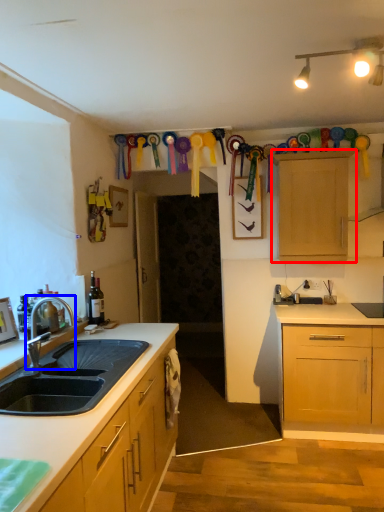
Question: Among these objects, which one is nearest to the camera, cabinetry (highlighted by a red box) or tap (highlighted by a blue box)?

Choices:
 (A) cabinetry
 (B) tap

Answer: (B)